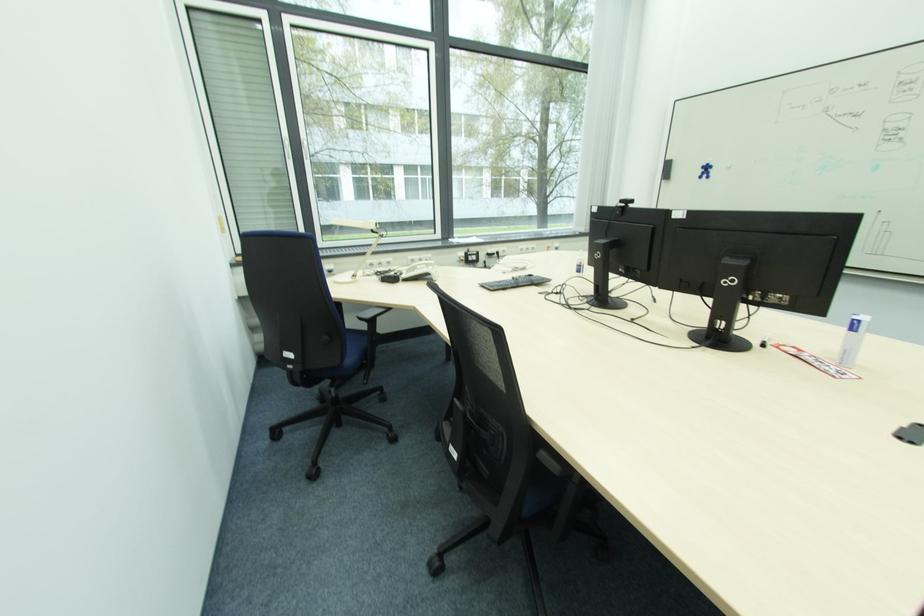
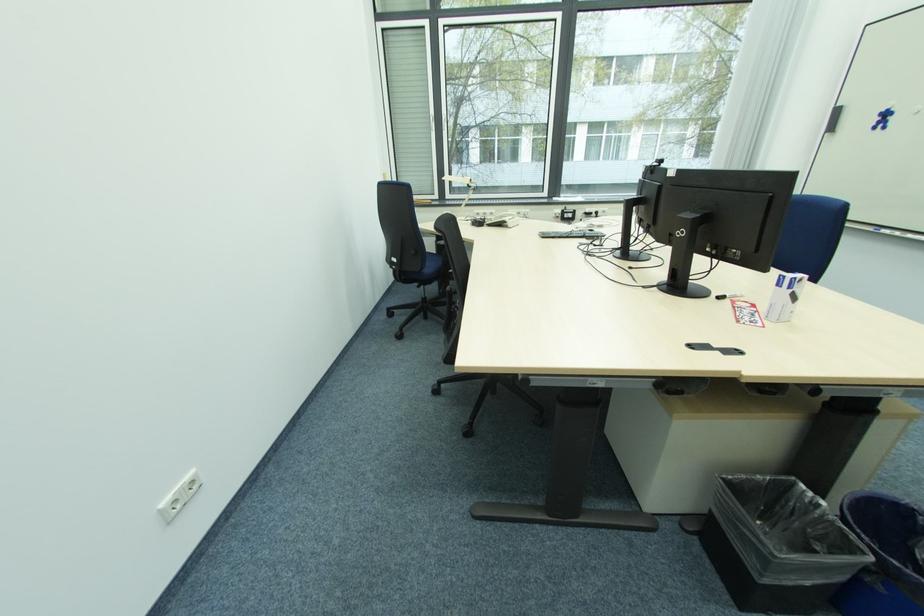
Locate, in the second image, the point that corresponds to pixel 380 281 in the first image.

(472, 225)